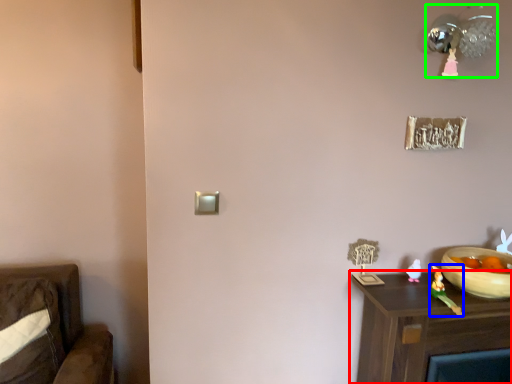
Question: Which object is positioned closest to nightstand (highlighted by a red box)? Select from toy (highlighted by a blue box) and light fixture (highlighted by a green box).

Choices:
 (A) toy
 (B) light fixture

Answer: (A)